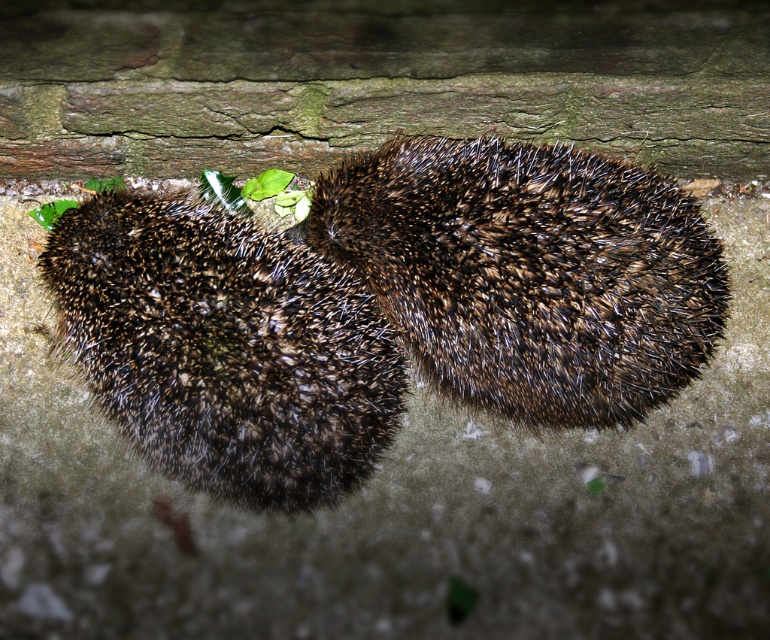
You are a wildlife photographer aiming to capture the hedgehogs in their natural position. Since you want to ensure both brown spiny hedgehog at center and brown spiny hedgehog at left are clearly visible in the frame, which hedgehog should you focus on first to account for their sizes?

The brown spiny hedgehog at left is taller than the brown spiny hedgehog at center, so focusing on the brown spiny hedgehog at left first would ensure proper focus adjustment for both sizes.

You are a photographer trying to capture both brown spiny hedgehog at center and brown spiny hedgehog at left in a single shot. Since you want to focus on the hedgehog closer to you, which one should you aim the camera at?

You should aim the camera at the brown spiny hedgehog at center because it is closer to the viewer than the brown spiny hedgehog at left, making it the one in focus.